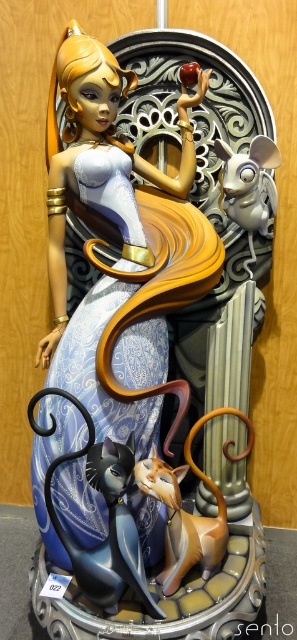
You are an artist trying to create a miniature version of the sculpture. The base you have can only support objects up to 10 cm in height. Given that the matte blue fabric doll at center is much taller than the satin silver mouse at upper right, can you safely assume the doll will fit on the base?

The matte blue fabric doll at center is much taller than the satin silver mouse at upper right. Since the base can only support up to 10 cm and the doll is taller than the mouse, but we don not know the exact height of the doll, it is possible that the doll may exceed the base height limit. Therefore, you cannot safely assume it will fit without knowing the doll

You are an artist who wants to create a miniature version of this sculpture. The base you have can only support objects up to the height of the matte black cat at lower center. Will the current base be sufficient for the matte blue fabric doll at center?

The matte blue fabric doll at center is taller than the matte black cat at lower center, so the base may not be sufficient as the doll exceeds the height limit of the cat.